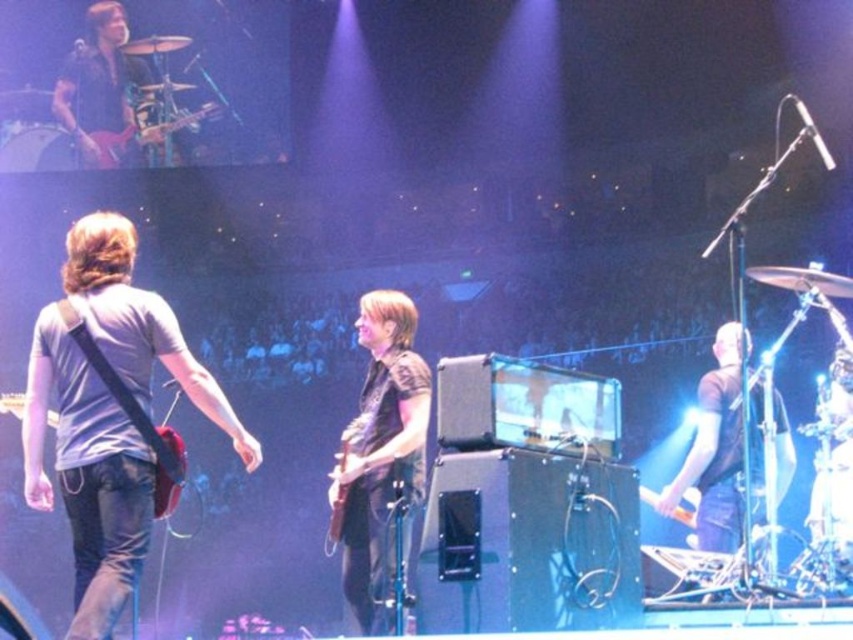
Question: Which point appears closest to the camera in this image?

Choices:
 (A) tap(167, 419)
 (B) tap(76, 360)
 (C) tap(114, 148)
 (D) tap(671, 483)

Answer: (B)

Question: Does dark brown leather guitar at center appear on the right side of shiny black guitar at upper left?

Choices:
 (A) yes
 (B) no

Answer: (A)

Question: Which point is farther to the camera?

Choices:
 (A) (105, 616)
 (B) (178, 477)
 (C) (393, 410)

Answer: (C)

Question: Can you confirm if gray matte t-shirt at center is positioned above matte black guitar at left?

Choices:
 (A) yes
 (B) no

Answer: (A)

Question: Where is shiny black guitar at upper left located in relation to matte black guitar at left in the image?

Choices:
 (A) above
 (B) below

Answer: (A)

Question: Which of the following is the closest to the observer?

Choices:
 (A) [x=364, y=532]
 (B) [x=91, y=573]

Answer: (B)